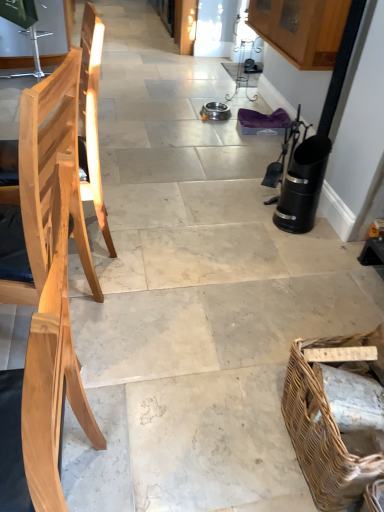
Locate an element on the screen. The image size is (384, 512). vacant space in between brown woven picnic basket at lower right and natural wood chair at left, marked as the first chair in a back-to-front arrangement is located at coordinates (188, 325).